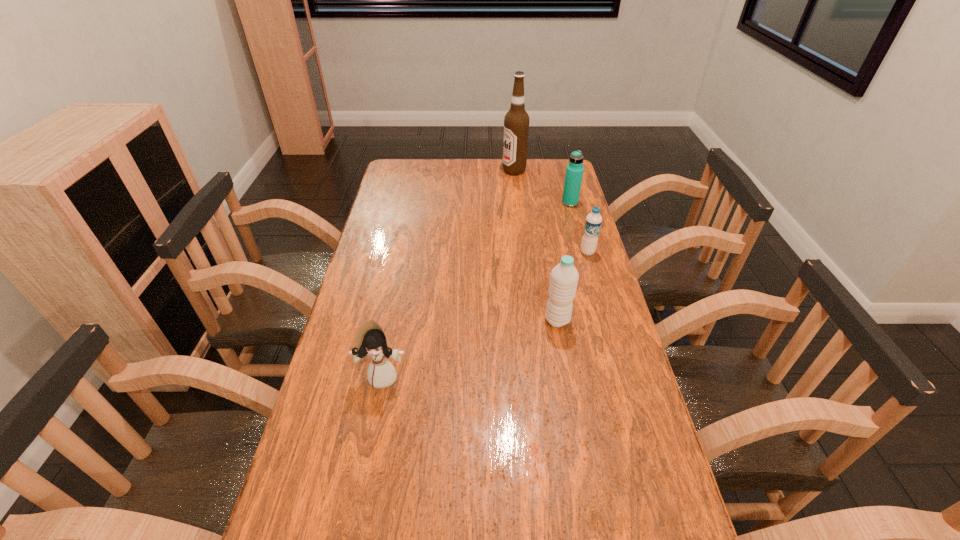
Where is `free space located 0.160m on the label of the alcohol`? This screenshot has height=540, width=960. free space located 0.160m on the label of the alcohol is located at coordinates (467, 171).

Where is `vacant area situated 0.230m on the label of the alcohol`? vacant area situated 0.230m on the label of the alcohol is located at coordinates (450, 171).

At what (x,y) coordinates should I click in order to perform the action: click on vacant space situated on the front of the nearest water bottle. Please return your answer as a coordinate pair (x, y). This screenshot has height=540, width=960. Looking at the image, I should click on (572, 407).

Find the location of `free location located on the left of the farthest water bottle`. free location located on the left of the farthest water bottle is located at coordinates (474, 203).

The image size is (960, 540). Find the location of `free location located at the front face of the leftmost object`. free location located at the front face of the leftmost object is located at coordinates (367, 460).

Locate an element on the screen. This screenshot has width=960, height=540. free space located 0.230m on the label of the third nearest object is located at coordinates (603, 305).

Image resolution: width=960 pixels, height=540 pixels. Find the location of `object that is at the far edge`. object that is at the far edge is located at coordinates (516, 122).

Identify the location of object that is at the left edge. This screenshot has height=540, width=960. (371, 340).

This screenshot has height=540, width=960. In the image, there is a desktop. Identify the location of free space at the far edge. (447, 163).

Identify the location of vacant space at the left edge of the desktop. The image size is (960, 540). (320, 448).